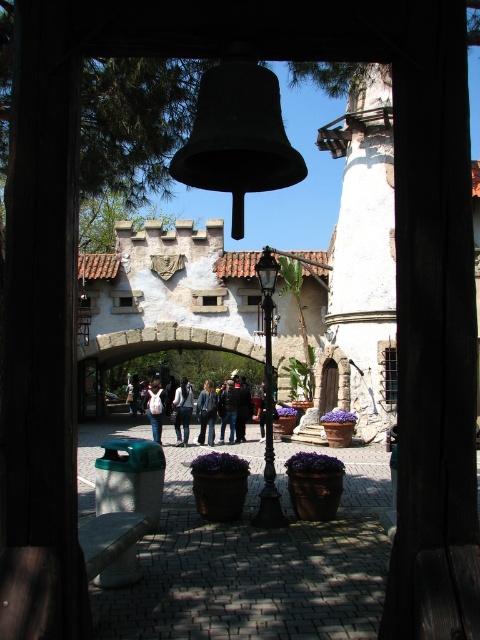
Question: Is dark blue jeans at center to the left of white cotton shirt at center from the viewer's perspective?

Choices:
 (A) yes
 (B) no

Answer: (B)

Question: Can you confirm if denim jacket at center is bigger than blue denim jeans at center?

Choices:
 (A) yes
 (B) no

Answer: (A)

Question: Which is nearer to the blue denim jeans at center?

Choices:
 (A) denim jacket at center
 (B) dark blue jeans at center

Answer: (B)

Question: Is denim jacket at center in front of white cotton shirt at center?

Choices:
 (A) no
 (B) yes

Answer: (B)

Question: Estimate the real-world distances between objects in this image. Which object is farther from the denim jacket at center?

Choices:
 (A) white cotton shirt at center
 (B) blue denim jeans at center

Answer: (A)

Question: Which point is closer to the camera taking this photo?

Choices:
 (A) (159, 412)
 (B) (227, 408)
 (C) (202, 444)

Answer: (C)